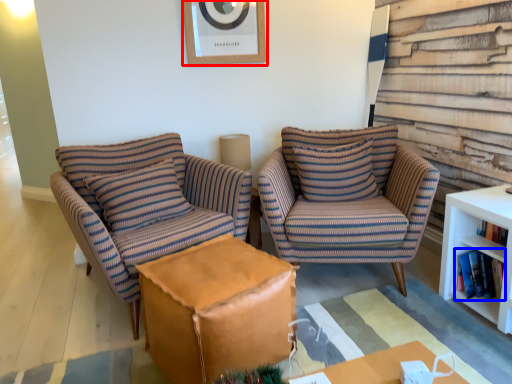
Question: Which object appears closest to the camera in this image, picture frame (highlighted by a red box) or book (highlighted by a blue box)?

Choices:
 (A) picture frame
 (B) book

Answer: (B)